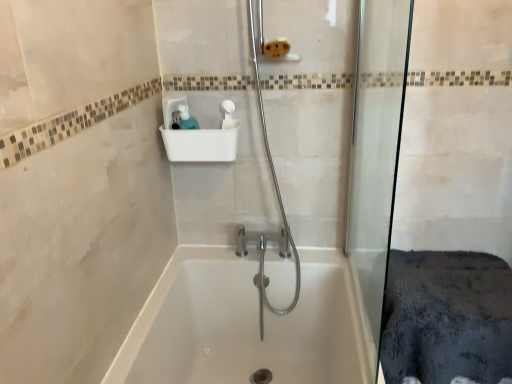
Question: Is white glossy bathtub at center oriented towards transparent glass shower door at right?

Choices:
 (A) no
 (B) yes

Answer: (A)

Question: Does white glossy bathtub at center appear on the right side of transparent glass shower door at right?

Choices:
 (A) yes
 (B) no

Answer: (B)

Question: Does white glossy bathtub at center have a greater height compared to transparent glass shower door at right?

Choices:
 (A) no
 (B) yes

Answer: (A)

Question: From the image's perspective, is white glossy bathtub at center on transparent glass shower door at right?

Choices:
 (A) no
 (B) yes

Answer: (A)

Question: Can you confirm if white glossy bathtub at center is wider than transparent glass shower door at right?

Choices:
 (A) no
 (B) yes

Answer: (B)

Question: From the image's perspective, is white plastic sink at upper center positioned above or below white glossy bathtub at center?

Choices:
 (A) below
 (B) above

Answer: (B)

Question: Is white plastic sink at upper center spatially inside white glossy bathtub at center, or outside of it?

Choices:
 (A) inside
 (B) outside

Answer: (B)

Question: Is white plastic sink at upper center taller or shorter than white glossy bathtub at center?

Choices:
 (A) short
 (B) tall

Answer: (A)

Question: In terms of width, does white plastic sink at upper center look wider or thinner when compared to white glossy bathtub at center?

Choices:
 (A) wide
 (B) thin

Answer: (B)

Question: From a real-world perspective, is transparent glass shower door at right positioned above or below white glossy bathtub at center?

Choices:
 (A) below
 (B) above

Answer: (B)

Question: Is transparent glass shower door at right taller or shorter than white glossy bathtub at center?

Choices:
 (A) tall
 (B) short

Answer: (A)

Question: Is transparent glass shower door at right spatially inside white glossy bathtub at center, or outside of it?

Choices:
 (A) outside
 (B) inside

Answer: (A)

Question: Is transparent glass shower door at right bigger or smaller than white glossy bathtub at center?

Choices:
 (A) big
 (B) small

Answer: (B)

Question: Is transparent glass shower door at right wider or thinner than white plastic sink at upper center?

Choices:
 (A) thin
 (B) wide

Answer: (A)

Question: Visually, is transparent glass shower door at right positioned to the left or to the right of white plastic sink at upper center?

Choices:
 (A) right
 (B) left

Answer: (A)